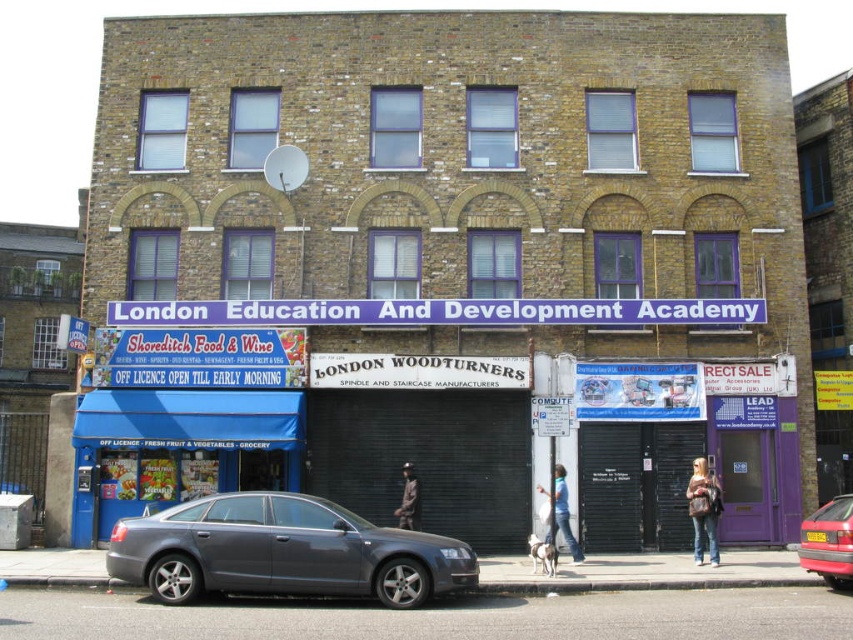
Is point (822, 529) closer to camera compared to point (550, 529)?

Yes, point (822, 529) is in front of point (550, 529).

Which is in front, point (822, 572) or point (564, 524)?

Point (822, 572) is more forward.

Where is `red metallic car at center`? This screenshot has height=640, width=853. red metallic car at center is located at coordinates (828, 541).

Between satin silver car at center and dark brown leather jacket at center, which one is positioned lower?

satin silver car at center is below.

Is satin silver car at center positioned in front of dark brown leather jacket at center?

Yes.

Is point (363, 589) closer to viewer compared to point (408, 508)?

Yes, it is.

Identify the location of satin silver car at center. (283, 552).

How far apart are satin silver car at center and red metallic car at center?

satin silver car at center and red metallic car at center are 12.20 meters apart.

Image resolution: width=853 pixels, height=640 pixels. Describe the element at coordinates (283, 552) in the screenshot. I see `satin silver car at center` at that location.

Identify the location of satin silver car at center. (283, 552).